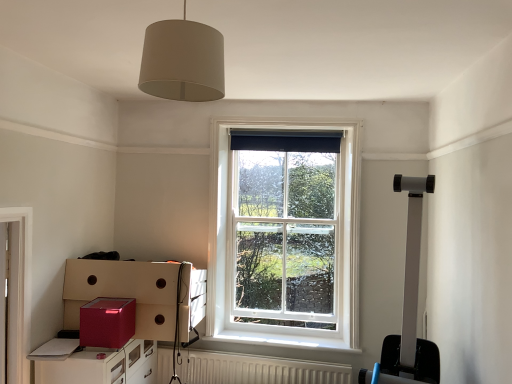
Question: Is white textured radiator at lower center far away from black fabric curtain at upper center?

Choices:
 (A) yes
 (B) no

Answer: (A)

Question: Is white textured radiator at lower center touching black fabric curtain at upper center?

Choices:
 (A) no
 (B) yes

Answer: (A)

Question: Does white textured radiator at lower center lie in front of black fabric curtain at upper center?

Choices:
 (A) no
 (B) yes

Answer: (B)

Question: Considering the relative positions of white textured radiator at lower center and black fabric curtain at upper center in the image provided, is white textured radiator at lower center to the right of black fabric curtain at upper center from the viewer's perspective?

Choices:
 (A) yes
 (B) no

Answer: (B)

Question: Can black fabric curtain at upper center be found inside white textured radiator at lower center?

Choices:
 (A) no
 (B) yes

Answer: (A)

Question: Considering the positions of shiny red cabinet at lower left and black fabric curtain at upper center in the image, is shiny red cabinet at lower left bigger or smaller than black fabric curtain at upper center?

Choices:
 (A) small
 (B) big

Answer: (B)

Question: From a real-world perspective, relative to black fabric curtain at upper center, is shiny red cabinet at lower left vertically above or below?

Choices:
 (A) below
 (B) above

Answer: (A)

Question: Is point (123, 379) positioned closer to the camera than point (276, 140)?

Choices:
 (A) farther
 (B) closer

Answer: (B)

Question: From their relative heights in the image, would you say shiny red cabinet at lower left is taller or shorter than black fabric curtain at upper center?

Choices:
 (A) tall
 (B) short

Answer: (A)

Question: Would you say shiny red cabinet at lower left is to the left or to the right of matte red cardboard box at lower left, the first cardboard box when ordered from back to front, in the picture?

Choices:
 (A) right
 (B) left

Answer: (B)

Question: Looking at their shapes, would you say shiny red cabinet at lower left is wider or thinner than matte red cardboard box at lower left, the first cardboard box when ordered from back to front?

Choices:
 (A) thin
 (B) wide

Answer: (A)

Question: From the image's perspective, is shiny red cabinet at lower left above or below matte red cardboard box at lower left, which is the 2th cardboard box from front to back?

Choices:
 (A) above
 (B) below

Answer: (B)

Question: Considering their positions, is shiny red cabinet at lower left located in front of or behind matte red cardboard box at lower left, which is the 2th cardboard box from front to back?

Choices:
 (A) behind
 (B) front

Answer: (B)

Question: Based on their sizes in the image, would you say shiny red cardboard box at lower left, positioned as the first cardboard box in front-to-back order, is bigger or smaller than black fabric curtain at upper center?

Choices:
 (A) big
 (B) small

Answer: (A)

Question: From the image's perspective, is shiny red cardboard box at lower left, positioned as the first cardboard box in front-to-back order, above or below black fabric curtain at upper center?

Choices:
 (A) above
 (B) below

Answer: (B)